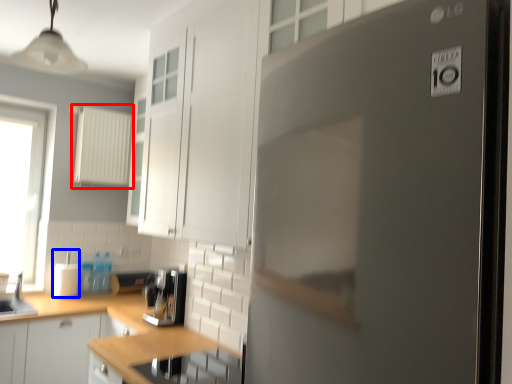
Question: Which of the following is the farthest to the observer, appliance (highlighted by a red box) or appliance (highlighted by a blue box)?

Choices:
 (A) appliance
 (B) appliance

Answer: (A)